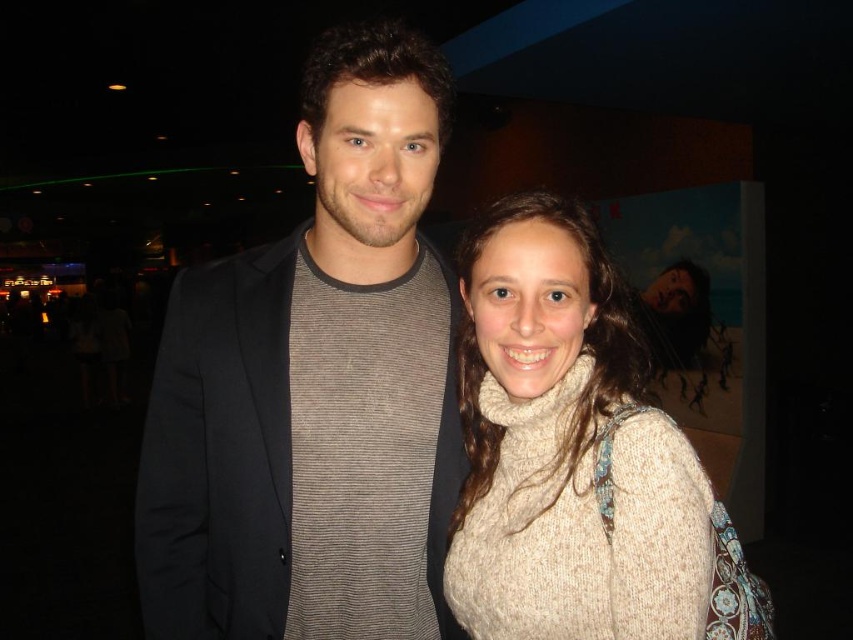
Looking at this image, you are a fashion stylist observing two people at a movie premiere. Both are wearing a dark gray knit sweater at center and a white knitted sweater at center. Which sweater is layered on top?

The dark gray knit sweater at center is positioned over the white knitted sweater at center, so it is layered on top.

You are a photographer at a fashion event. You need to capture a photo of both the dark gray knit sweater at center and the white knitted sweater at center. Which sweater should you focus on first to ensure it appears closer in the photo?

The dark gray knit sweater at center is further to the viewer than the white knitted sweater at center, so you should focus on the dark gray knit sweater at center first to ensure it appears closer in the photo.

You are a photographer at a fashion event. You need to capture a closeup shot of both the dark gray knit sweater at center and the white knitted sweater at center. Which sweater should you focus on first if you want to ensure both are in frame without moving the camera?

The dark gray knit sweater at center is larger in size than the white knitted sweater at center, so you should focus on the larger dark gray knit sweater at center first to ensure it fits within the frame before adjusting for the smaller white knitted sweater at center.